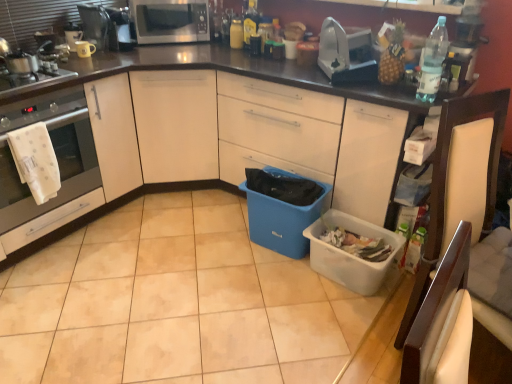
Question: Should I look upward or downward to see blue plastic bin at center, which appears as the first storage box when viewed from the left?

Choices:
 (A) down
 (B) up

Answer: (A)

Question: From the image's perspective, is white plastic storage box at lower right, the 2th storage box from the left, below beige tile at center?

Choices:
 (A) yes
 (B) no

Answer: (B)

Question: From the image's perspective, is white plastic storage box at lower right, which is counted as the first storage box, starting from the right, located above beige tile at center?

Choices:
 (A) no
 (B) yes

Answer: (B)

Question: Is white plastic storage box at lower right, which is counted as the first storage box, starting from the right, thinner than beige tile at center?

Choices:
 (A) no
 (B) yes

Answer: (B)

Question: Is white plastic storage box at lower right, the 2th storage box from the left, positioned before beige tile at center?

Choices:
 (A) no
 (B) yes

Answer: (A)

Question: Is white plastic storage box at lower right, the 2th storage box from the left, wider than beige tile at center?

Choices:
 (A) no
 (B) yes

Answer: (A)

Question: From a real-world perspective, is white plastic storage box at lower right, the 2th storage box from the left, located beneath beige tile at center?

Choices:
 (A) yes
 (B) no

Answer: (B)

Question: Considering the relative sizes of beige tile at center and clear plastic bottle at upper right, which appears as the 3th bottle when viewed from the left, in the image provided, is beige tile at center shorter than clear plastic bottle at upper right, which appears as the 3th bottle when viewed from the left,?

Choices:
 (A) yes
 (B) no

Answer: (A)

Question: From a real-world perspective, is beige tile at center under clear plastic bottle at upper right, which is counted as the 1th bottle, starting from the front?

Choices:
 (A) no
 (B) yes

Answer: (B)

Question: Does beige tile at center turn towards clear plastic bottle at upper right, which is counted as the 1th bottle, starting from the front?

Choices:
 (A) yes
 (B) no

Answer: (B)

Question: Is beige tile at center positioned in front of clear plastic bottle at upper right, which appears as the 1th bottle when viewed from the right?

Choices:
 (A) yes
 (B) no

Answer: (A)

Question: Is beige tile at center in contact with clear plastic bottle at upper right, which is the third bottle from back to front?

Choices:
 (A) no
 (B) yes

Answer: (A)

Question: From the image's perspective, is beige tile at center below clear plastic bottle at upper right, the first bottle from the bottom?

Choices:
 (A) no
 (B) yes

Answer: (B)

Question: Is metallic coffee maker at upper left, the 3th appliance positioned from the left, taller than blue plastic bin at center, which appears as the first storage box when viewed from the left?

Choices:
 (A) yes
 (B) no

Answer: (B)